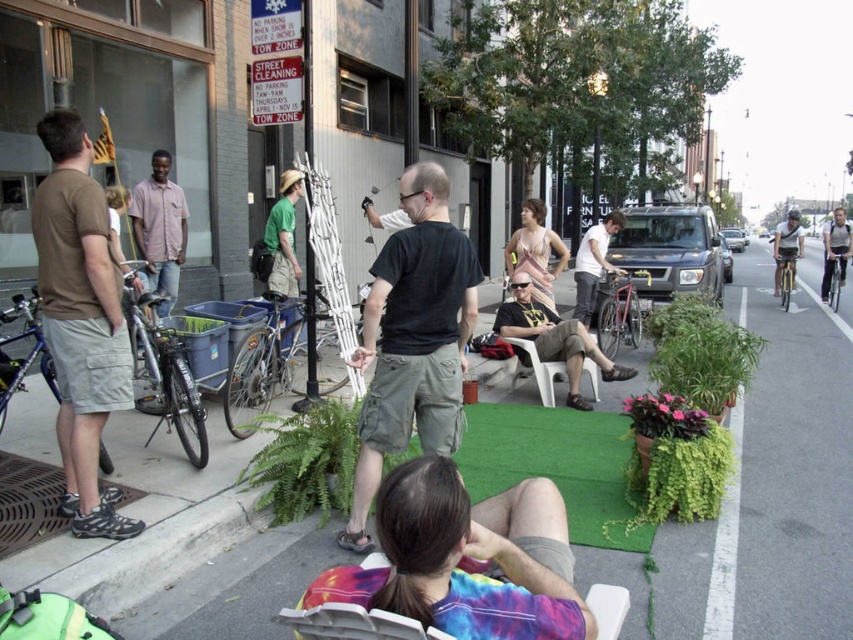
You are standing at the edge of the street and want to hand a flyer to both the black cotton shirt at center and the light blue shirt at right. If your reach is 15 meters, can you reach both without moving?

The black cotton shirt at center and the light blue shirt at right are 14.98 meters apart. Since your reach is 15 meters, you can reach both without moving.